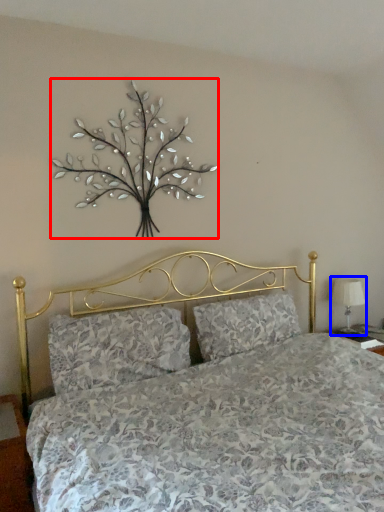
Question: Which object appears farthest to the camera in this image, floral arrangement (highlighted by a red box) or table lamp (highlighted by a blue box)?

Choices:
 (A) floral arrangement
 (B) table lamp

Answer: (B)